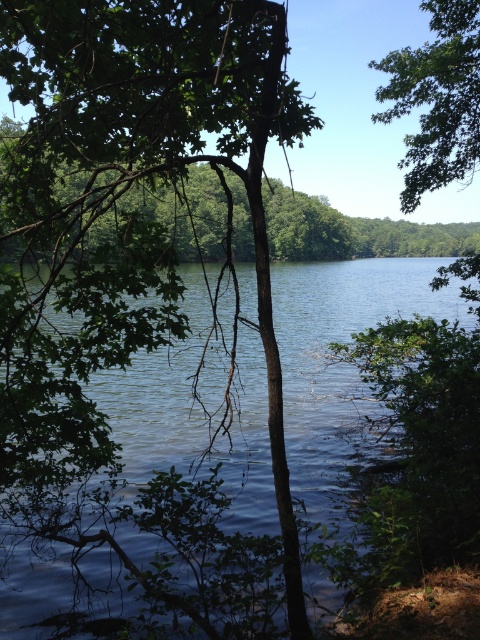
You are an observer standing near the lakeside. You notice the blue water at center and the green leafy tree at upper right. Which object appears bigger in the scene?

The blue water at center appears bigger than the green leafy tree at upper right because it has a larger size compared to the tree.